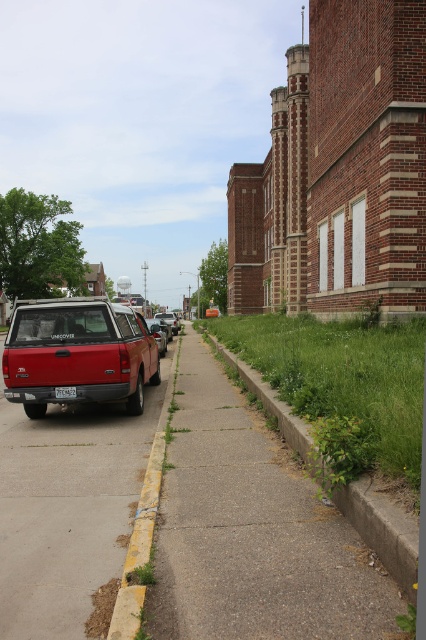
You are standing at the center of the street and see the point marked at coordinates (77, 353). What object does this point indicate?

The point at coordinates (77, 353) marks the matte red truck at left.

You are standing at the center of the street in the image. There is a green concrete curb at lower right marked by point (382, 529). Which direction should you walk to reach the green concrete curb at lower right?

The green concrete curb at lower right is located at the lower right of the image, so you should walk towards the lower right direction to reach it.